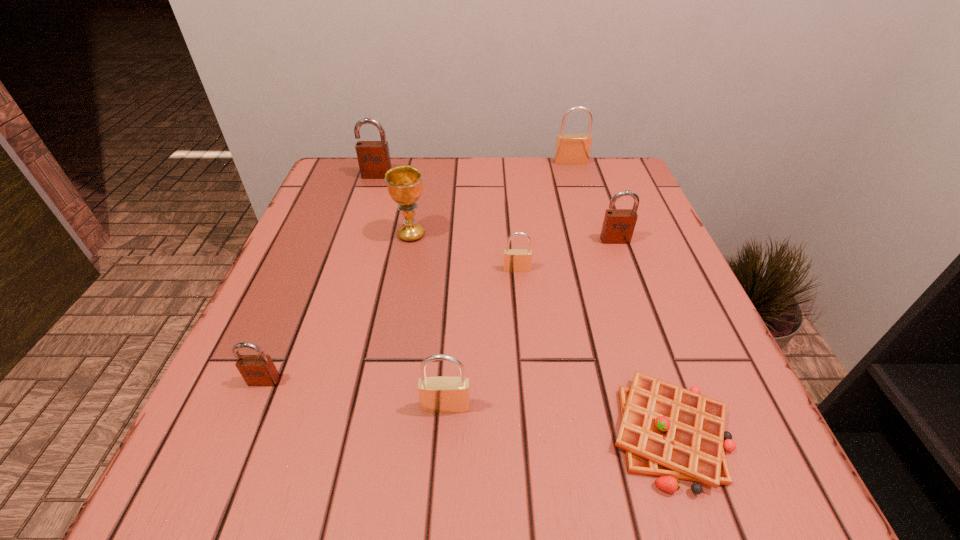
The width and height of the screenshot is (960, 540). What are the coordinates of `the fourth object from right to left` in the screenshot? It's located at (515, 260).

The height and width of the screenshot is (540, 960). What are the coordinates of `the second brass padlock from left to right` in the screenshot? It's located at (515, 260).

Identify the location of the leftmost brown padlock. (257, 370).

I want to click on the second nearest padlock, so click(257, 370).

Where is `the shortest object`? the shortest object is located at coordinates (667, 431).

Find the location of a particular element. free space located on the front-facing side of the farthest padlock is located at coordinates (579, 187).

You are a GUI agent. You are given a task and a screenshot of the screen. Output one action in this format:
    pyautogui.click(x=<x>, y=<y>)
    Task: Click on the free space located on the front-facing side of the second brown padlock from right to left
    Image resolution: width=960 pixels, height=540 pixels.
    Given the screenshot: What is the action you would take?
    pyautogui.click(x=369, y=201)

Locate an element on the screen. free location located on the front of the gold chalice is located at coordinates (404, 272).

Where is `vacant area located on the front-facing side of the second farthest brown padlock`? vacant area located on the front-facing side of the second farthest brown padlock is located at coordinates (640, 312).

Image resolution: width=960 pixels, height=540 pixels. In order to click on vacant region located 0.110m on the front-facing side of the nearest brass padlock in this screenshot , I will do `click(440, 493)`.